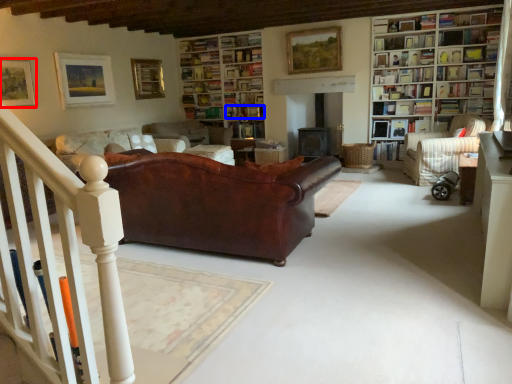
Question: Which object appears farthest to the camera in this image, picture frame (highlighted by a red box) or book (highlighted by a blue box)?

Choices:
 (A) picture frame
 (B) book

Answer: (B)